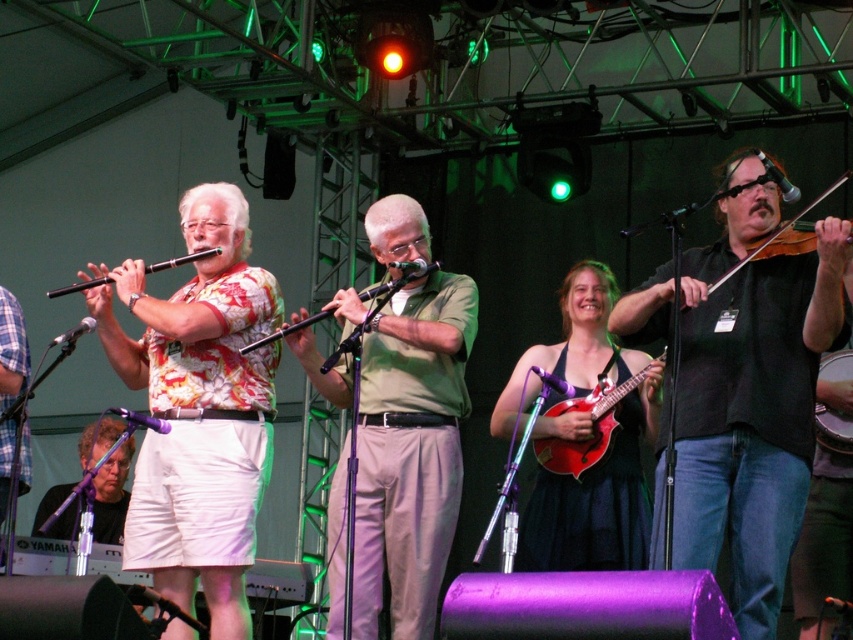
The image size is (853, 640). What are the coordinates of `floral shirt at center` in the screenshot? It's located at (199, 408).

From the picture: Does floral shirt at center appear on the left side of green matte flute at center?

Yes, floral shirt at center is to the left of green matte flute at center.

Between point (149, 378) and point (367, 525), which one is positioned behind?

The point (367, 525) is more distant.

Identify the location of floral shirt at center. This screenshot has width=853, height=640. (199, 408).

Is wooden violin at right wider than matte black flute at left?

Correct, the width of wooden violin at right exceeds that of matte black flute at left.

Can you confirm if wooden violin at right is thinner than matte black flute at left?

No.

This screenshot has width=853, height=640. What are the coordinates of `wooden violin at right` in the screenshot? It's located at (779, 230).

In the scene shown: Can you confirm if matte red mandolin at center is positioned above wooden violin at center?

No.

Does matte red mandolin at center appear on the left side of wooden violin at center?

No, matte red mandolin at center is not to the left of wooden violin at center.

Describe the element at coordinates (590, 428) in the screenshot. The height and width of the screenshot is (640, 853). I see `matte red mandolin at center` at that location.

The width and height of the screenshot is (853, 640). I want to click on matte red mandolin at center, so click(x=590, y=428).